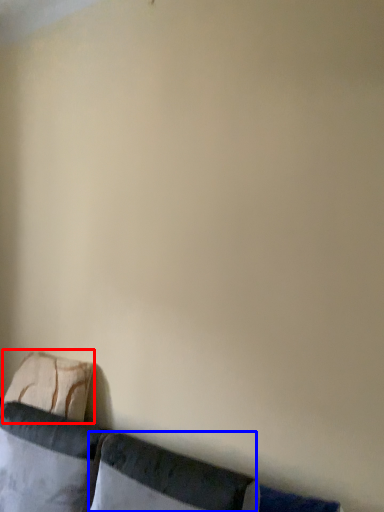
Question: Among these objects, which one is farthest to the camera, pillow (highlighted by a red box) or pillow (highlighted by a blue box)?

Choices:
 (A) pillow
 (B) pillow

Answer: (A)